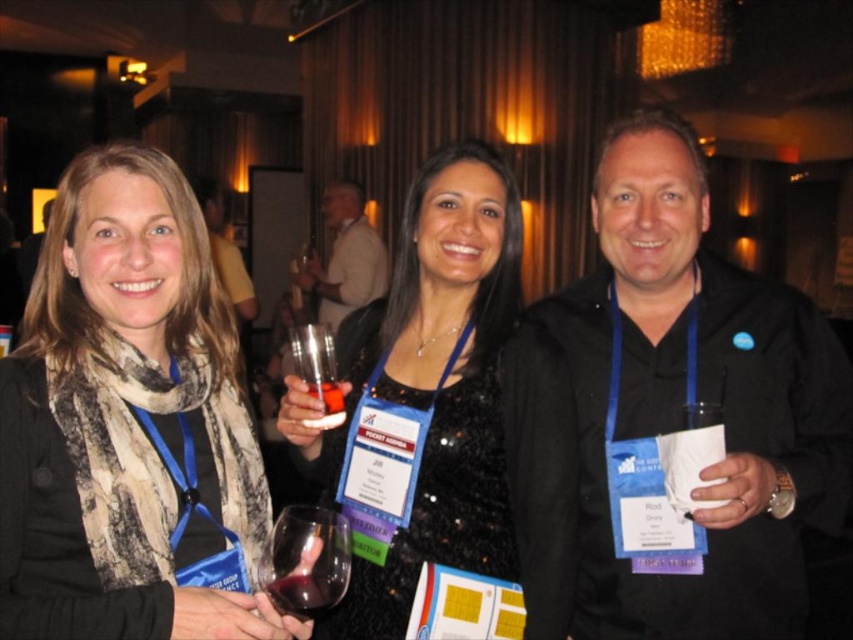
Question: Is black sequined dress at center thinner than translucent glass at center?

Choices:
 (A) yes
 (B) no

Answer: (B)

Question: Which of the following is the farthest from the observer?

Choices:
 (A) dark red glass at center
 (B) white fabric shirt at center

Answer: (B)

Question: Which point appears farthest from the camera in this image?

Choices:
 (A) (361, 246)
 (B) (517, 259)

Answer: (A)

Question: Observing the image, what is the correct spatial positioning of white fabric shirt at center in reference to transparent plastic wine glass at center?

Choices:
 (A) left
 (B) right

Answer: (A)

Question: Which point is closer to the camera taking this photo?

Choices:
 (A) (329, 401)
 (B) (372, 280)
 (C) (277, 524)
 (D) (86, 189)

Answer: (C)

Question: Does transparent plastic wine glass at center lie behind translucent glass at center?

Choices:
 (A) no
 (B) yes

Answer: (B)